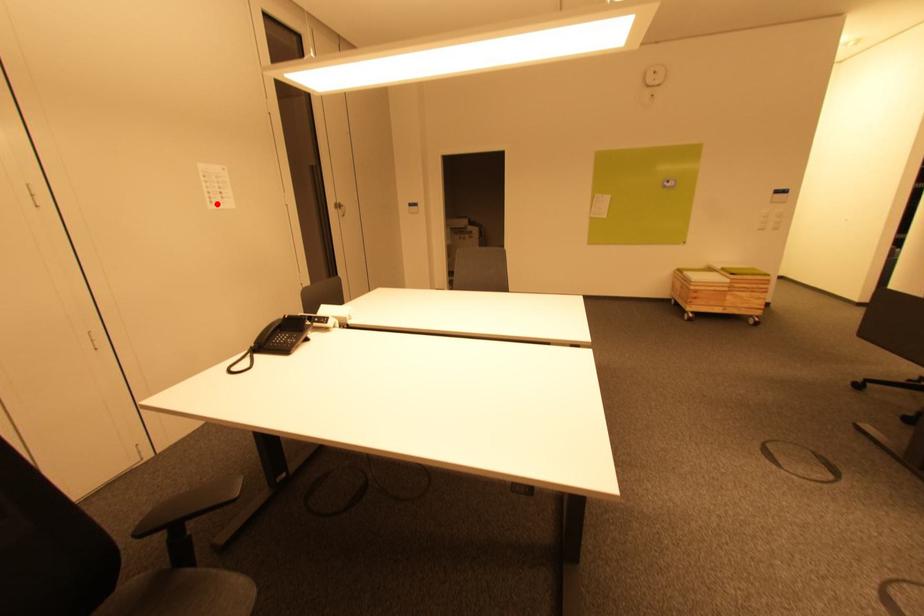
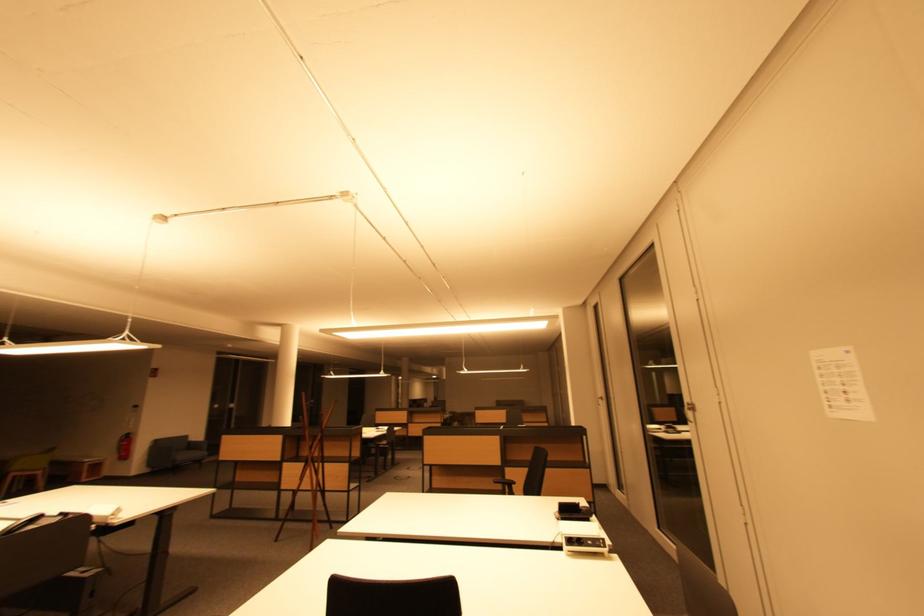
Where in the second image is the point corresponding to the highlighted location from the first image?

(834, 408)